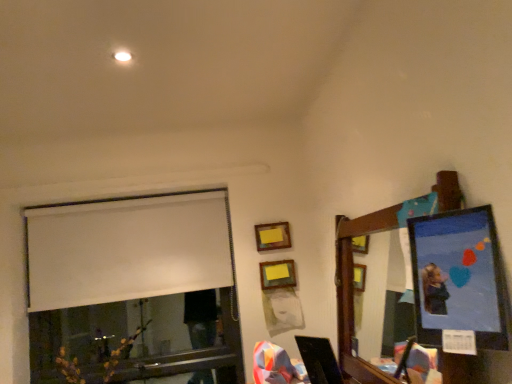
Question: Which direction should I rotate to look at wooden picture frame at upper center, the 1th picture frame when ordered from back to front, — up or down?

Choices:
 (A) down
 (B) up

Answer: (A)

Question: Considering the relative sizes of wooden matte picture frame at upper center, which appears as the second picture frame when viewed from the right, and wooden picture frame at upper center, which is the 3th picture frame in right-to-left order, in the image provided, is wooden matte picture frame at upper center, which appears as the second picture frame when viewed from the right, smaller than wooden picture frame at upper center, which is the 3th picture frame in right-to-left order,?

Choices:
 (A) no
 (B) yes

Answer: (A)

Question: Considering the relative sizes of wooden matte picture frame at upper center, the 2th picture frame positioned from the left, and wooden picture frame at upper center, acting as the 1th picture frame starting from the left, in the image provided, is wooden matte picture frame at upper center, the 2th picture frame positioned from the left, taller than wooden picture frame at upper center, acting as the 1th picture frame starting from the left,?

Choices:
 (A) yes
 (B) no

Answer: (B)

Question: Does wooden matte picture frame at upper center, the 2th picture frame positioned from the back, have a greater width compared to wooden picture frame at upper center, positioned as the third picture frame in front-to-back order?

Choices:
 (A) no
 (B) yes

Answer: (B)

Question: Is wooden matte picture frame at upper center, the 2th picture frame positioned from the left, further to camera compared to wooden picture frame at upper center, which is the 3th picture frame in right-to-left order?

Choices:
 (A) no
 (B) yes

Answer: (A)

Question: Can you confirm if wooden matte picture frame at upper center, which appears as the second picture frame when viewed from the right, is shorter than wooden picture frame at upper center, acting as the 1th picture frame starting from the left?

Choices:
 (A) yes
 (B) no

Answer: (A)

Question: Is the position of wooden matte picture frame at upper center, the 2th picture frame positioned from the back, less distant than that of wooden picture frame at upper center, the 1th picture frame when ordered from back to front?

Choices:
 (A) yes
 (B) no

Answer: (A)

Question: From a real-world perspective, does matte plastic picture frame at upper right, the 3th picture frame viewed from the left, sit lower than wooden matte picture frame at upper center, the second picture frame viewed from the front?

Choices:
 (A) no
 (B) yes

Answer: (A)

Question: From the image's perspective, would you say matte plastic picture frame at upper right, which is the 1th picture frame in front-to-back order, is shown under wooden matte picture frame at upper center, the 2th picture frame positioned from the left?

Choices:
 (A) yes
 (B) no

Answer: (B)

Question: Is matte plastic picture frame at upper right, placed as the 1th picture frame when sorted from right to left, to the left of wooden matte picture frame at upper center, the second picture frame viewed from the front, from the viewer's perspective?

Choices:
 (A) yes
 (B) no

Answer: (B)

Question: Does matte plastic picture frame at upper right, the 3th picture frame viewed from the left, have a greater width compared to wooden matte picture frame at upper center, the second picture frame viewed from the front?

Choices:
 (A) yes
 (B) no

Answer: (A)

Question: From the image's perspective, does matte plastic picture frame at upper right, placed as the 1th picture frame when sorted from right to left, appear higher than wooden matte picture frame at upper center, the 2th picture frame positioned from the left?

Choices:
 (A) no
 (B) yes

Answer: (B)

Question: Is matte plastic picture frame at upper right, the 3th picture frame viewed from the left, smaller than wooden matte picture frame at upper center, the 2th picture frame positioned from the back?

Choices:
 (A) no
 (B) yes

Answer: (A)

Question: Is wooden mirror at upper right located outside white matte window at upper left?

Choices:
 (A) no
 (B) yes

Answer: (B)